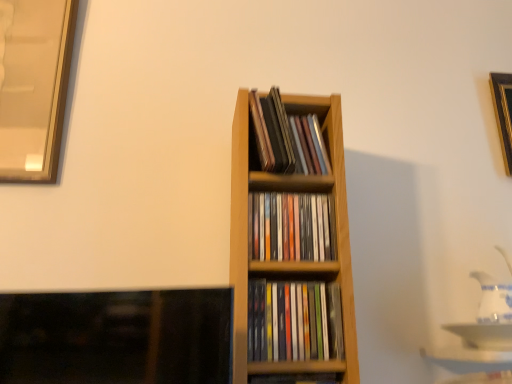
Question: Does wooden cd case at center, the 2th book when ordered from top to bottom, have a greater height compared to gold metallic picture frame at upper right?

Choices:
 (A) yes
 (B) no

Answer: (B)

Question: Can you confirm if wooden cd case at center, the 2th book when ordered from top to bottom, is bigger than gold metallic picture frame at upper right?

Choices:
 (A) no
 (B) yes

Answer: (A)

Question: Considering the relative sizes of wooden cd case at center, which appears as the 3th book when ordered from the bottom, and gold metallic picture frame at upper right in the image provided, is wooden cd case at center, which appears as the 3th book when ordered from the bottom, thinner than gold metallic picture frame at upper right?

Choices:
 (A) yes
 (B) no

Answer: (B)

Question: Can you confirm if wooden cd case at center, which appears as the 3th book when ordered from the bottom, is shorter than gold metallic picture frame at upper right?

Choices:
 (A) yes
 (B) no

Answer: (A)

Question: Is wooden cd case at center, the 2th book when ordered from top to bottom, looking in the opposite direction of gold metallic picture frame at upper right?

Choices:
 (A) no
 (B) yes

Answer: (A)

Question: From the image's perspective, relative to wooden cd case at center, which appears as the 3th book when ordered from the bottom, is white glossy tea pot at right above or below?

Choices:
 (A) above
 (B) below

Answer: (B)

Question: Is white glossy tea pot at right spatially inside wooden cd case at center, the 2th book when ordered from top to bottom, or outside of it?

Choices:
 (A) inside
 (B) outside

Answer: (B)

Question: Considering the positions of white glossy tea pot at right and wooden cd case at center, the 2th book when ordered from top to bottom, in the image, is white glossy tea pot at right bigger or smaller than wooden cd case at center, the 2th book when ordered from top to bottom,?

Choices:
 (A) small
 (B) big

Answer: (B)

Question: Considering their positions, is white glossy tea pot at right located in front of or behind wooden cd case at center, which appears as the 3th book when ordered from the bottom?

Choices:
 (A) front
 (B) behind

Answer: (B)

Question: From a real-world perspective, is wooden cd case at center, which is counted as the 1th book, starting from the top, above or below gold metallic picture frame at upper right?

Choices:
 (A) below
 (B) above

Answer: (A)

Question: Considering the positions of wooden cd case at center, which is counted as the 1th book, starting from the top, and gold metallic picture frame at upper right in the image, is wooden cd case at center, which is counted as the 1th book, starting from the top, taller or shorter than gold metallic picture frame at upper right?

Choices:
 (A) tall
 (B) short

Answer: (B)

Question: Is wooden cd case at center, which is counted as the 1th book, starting from the top, wider or thinner than gold metallic picture frame at upper right?

Choices:
 (A) thin
 (B) wide

Answer: (B)

Question: From the image's perspective, is wooden cd case at center, arranged as the 4th book when ordered from the bottom, located above or below gold metallic picture frame at upper right?

Choices:
 (A) above
 (B) below

Answer: (B)

Question: In terms of width, does wooden bookshelf at center, the fourth book positioned from the top, look wider or thinner when compared to wooden cd case at center, which appears as the 3th book when ordered from the bottom?

Choices:
 (A) thin
 (B) wide

Answer: (B)

Question: Is point (271, 380) positioned closer to the camera than point (329, 230)?

Choices:
 (A) closer
 (B) farther

Answer: (A)